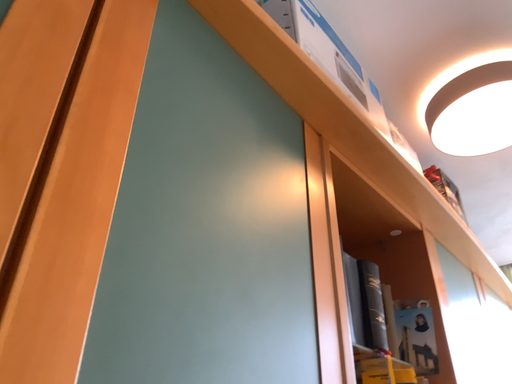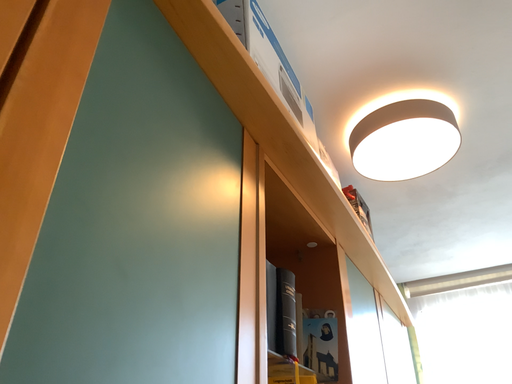
Question: How did the camera likely rotate when shooting the video?

Choices:
 (A) rotated left
 (B) rotated right

Answer: (B)